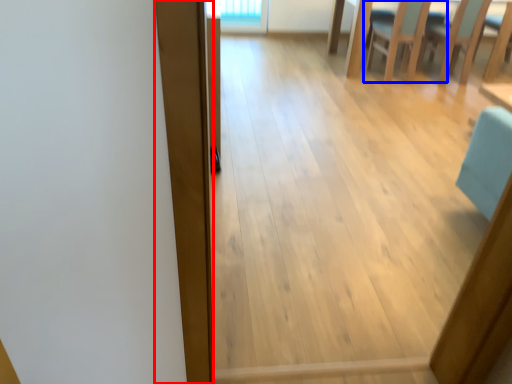
Question: Which point is further to the camera, plank (highlighted by a red box) or chair (highlighted by a blue box)?

Choices:
 (A) plank
 (B) chair

Answer: (B)